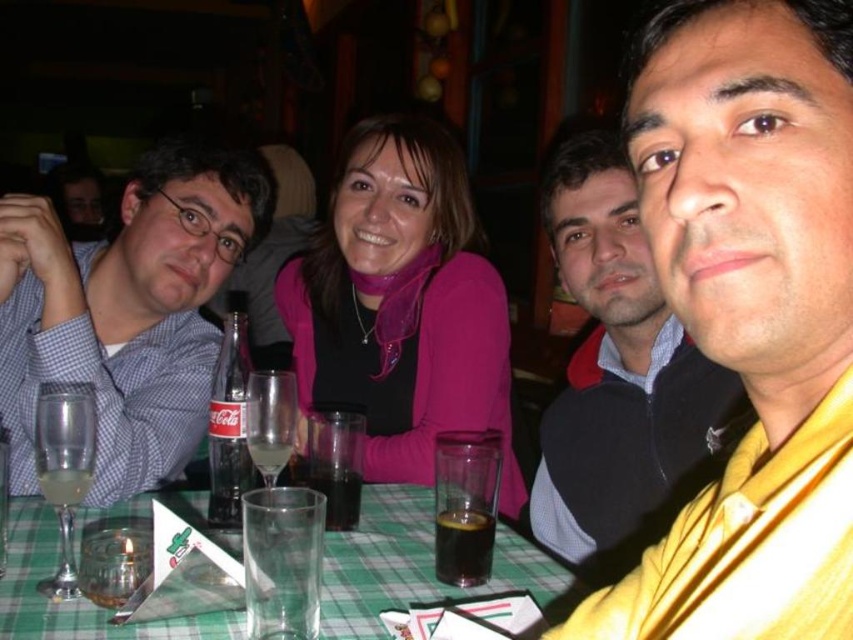
Between green checkered tablecloth at lower center and clear glass coca-cola at center, which one has less height?

Standing shorter between the two is green checkered tablecloth at lower center.

Is green checkered tablecloth at lower center taller than clear glass coca-cola at center?

Incorrect, green checkered tablecloth at lower center's height is not larger of clear glass coca-cola at center's.

Is point (413, 573) closer to camera compared to point (264, 445)?

Yes, it is in front of point (264, 445).

Where is `green checkered tablecloth at lower center`? This screenshot has width=853, height=640. green checkered tablecloth at lower center is located at coordinates (412, 564).

Does point (190, 173) come in front of point (83, 492)?

No, it is behind (83, 492).

At what (x,y) coordinates should I click in order to perform the action: click on matte blue shirt at left. Please return your answer as a coordinate pair (x, y). The width and height of the screenshot is (853, 640). Looking at the image, I should click on (126, 310).

Does pink matte scarf at center have a greater width compared to yellow fabric at right?

Yes.

What do you see at coordinates (402, 305) in the screenshot? I see `pink matte scarf at center` at bounding box center [402, 305].

Who is more distant from viewer, [503,417] or [692,488]?

The point [503,417] is behind.

At what (x,y) coordinates should I click in order to perform the action: click on pink matte scarf at center. Please return your answer as a coordinate pair (x, y). The width and height of the screenshot is (853, 640). Looking at the image, I should click on (402, 305).